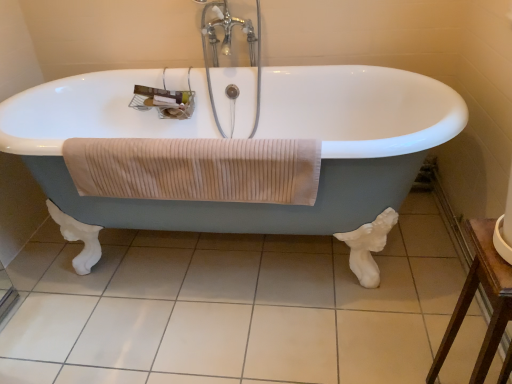
The width and height of the screenshot is (512, 384). What do you see at coordinates (208, 67) in the screenshot?
I see `chrome metallic faucet at upper center` at bounding box center [208, 67].

Find the location of a particular element. The image size is (512, 384). brown wooden table at lower right is located at coordinates (473, 296).

Locate an element on the screen. Image resolution: width=512 pixels, height=384 pixels. white tile at center is located at coordinates [231, 308].

Based on the photo, would you say brown wooden table at lower right is inside or outside white tile at center?

brown wooden table at lower right is not inside white tile at center, it's outside.

Can you confirm if brown wooden table at lower right is wider than white tile at center?

No, brown wooden table at lower right is not wider than white tile at center.

This screenshot has height=384, width=512. I want to click on furniture on the right of white tile at center, so click(x=473, y=296).

Can you tell me how much white tile at center and beige ribbed towel at center differ in facing direction?

The angle between the facing direction of white tile at center and the facing direction of beige ribbed towel at center is 88.1 degrees.

Which object is positioned more to the right, white tile at center or beige ribbed towel at center?

From the viewer's perspective, white tile at center appears more on the right side.

Looking at this image, which of these two, white tile at center or beige ribbed towel at center, stands shorter?

white tile at center is shorter.

Is beige ribbed towel at center a part of white tile at center?

No.

Is point (214, 112) less distant than point (158, 238)?

Yes, point (214, 112) is in front of point (158, 238).

Is chrome metallic faucet at upper center turned away from white tile at center?

No, chrome metallic faucet at upper center is not facing the opposite direction of white tile at center.

From the image's perspective, which object appears higher, chrome metallic faucet at upper center or white tile at center?

chrome metallic faucet at upper center appears higher in the image.

From a real-world perspective, is chrome metallic faucet at upper center above or below white tile at center?

In terms of real-world spatial position, chrome metallic faucet at upper center is above white tile at center.

Does chrome metallic faucet at upper center turn towards brown wooden table at lower right?

No, chrome metallic faucet at upper center does not turn towards brown wooden table at lower right.

Can you confirm if chrome metallic faucet at upper center is shorter than brown wooden table at lower right?

Incorrect, the height of chrome metallic faucet at upper center does not fall short of that of brown wooden table at lower right.

Considering the positions of objects chrome metallic faucet at upper center and brown wooden table at lower right in the image provided, who is more to the left, chrome metallic faucet at upper center or brown wooden table at lower right?

Positioned to the left is chrome metallic faucet at upper center.

Which is in front, chrome metallic faucet at upper center or brown wooden table at lower right?

brown wooden table at lower right is more forward.

Could you tell me if white glossy bathtub at center is turned towards white tile at center?

No, white glossy bathtub at center is not oriented towards white tile at center.

Is white glossy bathtub at center positioned far away from white tile at center?

No, white glossy bathtub at center is not far from white tile at center.

From a real-world perspective, relative to white tile at center, is white glossy bathtub at center vertically above or below?

white glossy bathtub at center is above white tile at center.

From the image's perspective, is white glossy bathtub at center beneath white tile at center?

No.

Can you confirm if white glossy bathtub at center is positioned to the right of beige ribbed towel at center?

Indeed, white glossy bathtub at center is positioned on the right side of beige ribbed towel at center.

Would you say white glossy bathtub at center is a long distance from beige ribbed towel at center?

No, white glossy bathtub at center is not far away from beige ribbed towel at center.

From a real-world perspective, is white glossy bathtub at center physically above beige ribbed towel at center?

No, from a real-world perspective, white glossy bathtub at center is not above beige ribbed towel at center.

Is white glossy bathtub at center further to the viewer compared to beige ribbed towel at center?

No, it is in front of beige ribbed towel at center.

Is white glossy bathtub at center aimed at brown wooden table at lower right?

Yes, white glossy bathtub at center faces towards brown wooden table at lower right.

Who is shorter, white glossy bathtub at center or brown wooden table at lower right?

brown wooden table at lower right is shorter.

From the image's perspective, is white glossy bathtub at center above or below brown wooden table at lower right?

white glossy bathtub at center is above brown wooden table at lower right.

Considering the points (374, 170) and (459, 321), which point is behind, point (374, 170) or point (459, 321)?

Point (374, 170)

Locate an element on the screen. The height and width of the screenshot is (384, 512). tile behind the brown wooden table at lower right is located at coordinates (x=231, y=308).

You are a GUI agent. You are given a task and a screenshot of the screen. Output one action in this format:
    pyautogui.click(x=<x>, y=<y>)
    Task: Click on the tile below the beige ribbed towel at center (from the image's perspective)
    The width and height of the screenshot is (512, 384).
    Given the screenshot: What is the action you would take?
    pyautogui.click(x=231, y=308)

When comparing their distances from beige ribbed towel at center, does white glossy bathtub at center or brown wooden table at lower right seem further?

brown wooden table at lower right lies further to beige ribbed towel at center than the other object.

Looking at this image, when comparing their distances from white tile at center, does white glossy bathtub at center or chrome metallic faucet at upper center seem further?

chrome metallic faucet at upper center is positioned further to the anchor white tile at center.

Based on their spatial positions, is white tile at center or white glossy bathtub at center closer to beige ribbed towel at center?

Based on the image, white glossy bathtub at center appears to be nearer to beige ribbed towel at center.

Looking at the image, which one is located further to chrome metallic faucet at upper center, white tile at center or beige ribbed towel at center?

Based on the image, white tile at center appears to be further to chrome metallic faucet at upper center.

From the picture: From the image, which object appears to be nearer to chrome metallic faucet at upper center, white tile at center or white glossy bathtub at center?

Among the two, white glossy bathtub at center is located nearer to chrome metallic faucet at upper center.

Looking at the image, which one is located further to beige ribbed towel at center, chrome metallic faucet at upper center or brown wooden table at lower right?

chrome metallic faucet at upper center is positioned further to the anchor beige ribbed towel at center.

Which object lies nearer to the anchor point white tile at center, brown wooden table at lower right or chrome metallic faucet at upper center?

The object closer to white tile at center is brown wooden table at lower right.

When comparing their distances from white tile at center, does brown wooden table at lower right or beige ribbed towel at center seem closer?

beige ribbed towel at center is closer to white tile at center.

The image size is (512, 384). I want to click on bath towel between white glossy bathtub at center and white tile at center vertically, so tap(196, 169).

Find the location of a particular element. The width and height of the screenshot is (512, 384). bath towel located between white glossy bathtub at center and chrome metallic faucet at upper center in the depth direction is located at coordinates (196, 169).

Locate an element on the screen. tile between white glossy bathtub at center and brown wooden table at lower right in the horizontal direction is located at coordinates (231, 308).

Image resolution: width=512 pixels, height=384 pixels. Find the location of `tile between chrome metallic faucet at upper center and brown wooden table at lower right in the vertical direction`. tile between chrome metallic faucet at upper center and brown wooden table at lower right in the vertical direction is located at coordinates (231, 308).